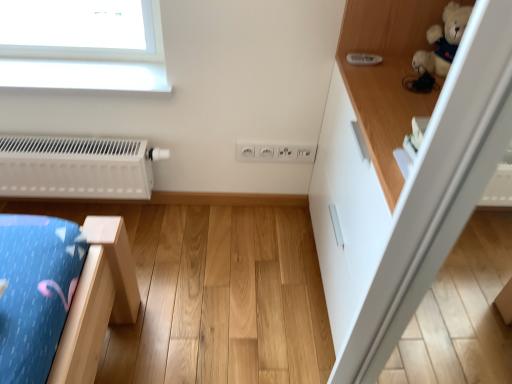
Question: From a real-world perspective, relative to white matte radiator at left, is white plastic electric outlet at center vertically above or below?

Choices:
 (A) below
 (B) above

Answer: (B)

Question: Is white plastic electric outlet at center bigger or smaller than white matte radiator at left?

Choices:
 (A) big
 (B) small

Answer: (B)

Question: Which object is positioned farthest from the white plastic electric outlet at center?

Choices:
 (A) white glossy cabinet at upper right
 (B) white matte radiator at left

Answer: (B)

Question: Considering the real-world distances, which object is farthest from the white matte radiator at left?

Choices:
 (A) white glossy cabinet at upper right
 (B) white plastic electric outlet at center

Answer: (A)